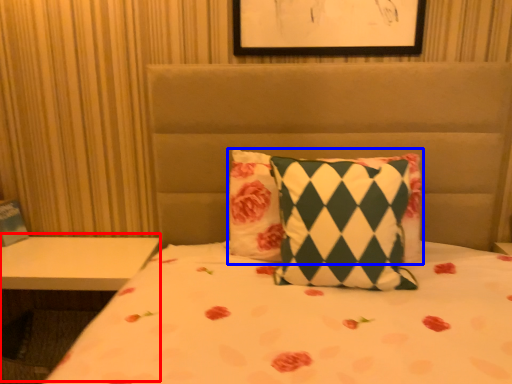
Question: Which of the following is the farthest to the observer, table (highlighted by a red box) or pillow (highlighted by a blue box)?

Choices:
 (A) table
 (B) pillow

Answer: (A)